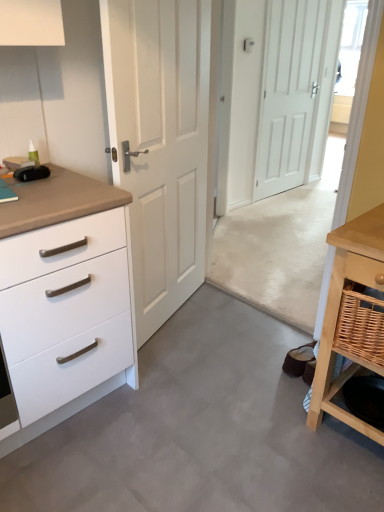
This screenshot has height=512, width=384. I want to click on free space between light wood table at lower right and white matte door at center, which is counted as the first door, starting from the front, so click(x=236, y=352).